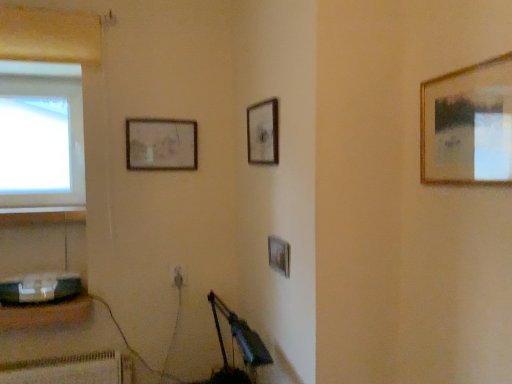
At what (x,y) coordinates should I click in order to perform the action: click on white plastic electric outlet at lower center. Please return your answer as a coordinate pair (x, y). The height and width of the screenshot is (384, 512). Looking at the image, I should click on (178, 277).

Image resolution: width=512 pixels, height=384 pixels. I want to click on transparent glass window at upper left, so click(41, 137).

Describe the element at coordinates (263, 133) in the screenshot. This screenshot has width=512, height=384. I see `wooden picture frame at upper center, the third picture frame viewed from the right` at that location.

This screenshot has width=512, height=384. Identify the location of wooden picture frame at upper center, the third picture frame viewed from the right. (263, 133).

What is the approximate height of metallic gray speaker at lower left?

It is 2.86 inches.

Measure the distance between gold metallic picture frame at upper right, which is the 1th picture frame from right to left, and camera.

The depth of gold metallic picture frame at upper right, which is the 1th picture frame from right to left, is 34.31 inches.

Identify the location of matte black toaster at lower left. This screenshot has width=512, height=384. (40, 288).

In order to click on matte wooden picture frame at upper center, which ranks as the fourth picture frame in right-to-left order in this screenshot , I will do `click(161, 144)`.

What do you see at coordinates (161, 144) in the screenshot?
I see `matte wooden picture frame at upper center, the first picture frame in the back-to-front sequence` at bounding box center [161, 144].

Image resolution: width=512 pixels, height=384 pixels. What do you see at coordinates (279, 255) in the screenshot? I see `wooden picture frame at center, the 2th picture frame viewed from the right` at bounding box center [279, 255].

What are the coordinates of `white plastic electric outlet at lower center` in the screenshot? It's located at (178, 277).

Which of these two, matte wooden picture frame at upper center, the first picture frame in the back-to-front sequence, or wooden picture frame at upper center, the 2th picture frame when ordered from left to right, is smaller?

matte wooden picture frame at upper center, the first picture frame in the back-to-front sequence.

Is matte wooden picture frame at upper center, placed as the fourth picture frame when sorted from front to back, far from wooden picture frame at upper center, the 2th picture frame positioned from the back?

No, matte wooden picture frame at upper center, placed as the fourth picture frame when sorted from front to back, is not far from wooden picture frame at upper center, the 2th picture frame positioned from the back.

Between matte wooden picture frame at upper center, marked as the first picture frame in a left-to-right arrangement, and wooden picture frame at upper center, the 2th picture frame when ordered from left to right, which one appears on the left side from the viewer's perspective?

matte wooden picture frame at upper center, marked as the first picture frame in a left-to-right arrangement, is more to the left.

Measure the distance between matte wooden picture frame at upper center, the first picture frame in the back-to-front sequence, and wooden picture frame at upper center, the 2th picture frame positioned from the back.

matte wooden picture frame at upper center, the first picture frame in the back-to-front sequence, is 46.82 centimeters from wooden picture frame at upper center, the 2th picture frame positioned from the back.

Considering the sizes of matte black toaster at lower left and wooden picture frame at upper center, the 2th picture frame when ordered from left to right, in the image, is matte black toaster at lower left wider or thinner than wooden picture frame at upper center, the 2th picture frame when ordered from left to right,?

Considering their sizes, matte black toaster at lower left looks broader than wooden picture frame at upper center, the 2th picture frame when ordered from left to right.

Is wooden picture frame at upper center, the third picture frame viewed from the right, a part of matte black toaster at lower left?

No, wooden picture frame at upper center, the third picture frame viewed from the right, is located outside of matte black toaster at lower left.

Between matte black toaster at lower left and wooden picture frame at upper center, positioned as the third picture frame in front-to-back order, which one has less height?

With less height is matte black toaster at lower left.

Is point (1, 305) closer to camera compared to point (136, 153)?

Yes, point (1, 305) is in front of point (136, 153).

Looking at this image, from the image's perspective, is metallic gray speaker at lower left positioned above or below matte wooden picture frame at upper center, marked as the first picture frame in a left-to-right arrangement?

Based on their image positions, metallic gray speaker at lower left is located beneath matte wooden picture frame at upper center, marked as the first picture frame in a left-to-right arrangement.

Which of these two, metallic gray speaker at lower left or matte wooden picture frame at upper center, the first picture frame in the back-to-front sequence, is bigger?

With larger size is metallic gray speaker at lower left.

Which of these two, metallic gray speaker at lower left or matte wooden picture frame at upper center, the first picture frame in the back-to-front sequence, is wider?

metallic gray speaker at lower left.

Between transparent glass window at upper left and wooden picture frame at center, which is the third picture frame in left-to-right order, which one has less height?

wooden picture frame at center, which is the third picture frame in left-to-right order, is shorter.

From the image's perspective, is transparent glass window at upper left on wooden picture frame at center, the 2th picture frame viewed from the right?

Yes, from the image's perspective, transparent glass window at upper left is above wooden picture frame at center, the 2th picture frame viewed from the right.

Consider the image. From the image's perspective, which is above, matte black toaster at lower left or metallic gray speaker at lower left?

matte black toaster at lower left.

Are matte black toaster at lower left and metallic gray speaker at lower left beside each other?

Indeed, matte black toaster at lower left and metallic gray speaker at lower left are beside each other and touching.

From a real-world perspective, who is located higher, matte black toaster at lower left or metallic gray speaker at lower left?

matte black toaster at lower left.

Image resolution: width=512 pixels, height=384 pixels. In the image, there is a matte wooden picture frame at upper center, marked as the first picture frame in a left-to-right arrangement. Identify the location of window above it (from the image's perspective). point(41,137).

Is matte wooden picture frame at upper center, marked as the first picture frame in a left-to-right arrangement, oriented towards transparent glass window at upper left?

No, matte wooden picture frame at upper center, marked as the first picture frame in a left-to-right arrangement, is not aimed at transparent glass window at upper left.

From the image's perspective, is gold metallic picture frame at upper right, the 4th picture frame in the back-to-front sequence, on top of matte black toaster at lower left?

Indeed, from the image's perspective, gold metallic picture frame at upper right, the 4th picture frame in the back-to-front sequence, is shown above matte black toaster at lower left.

Is point (471, 118) in front of point (69, 275)?

Yes.

In terms of width, does gold metallic picture frame at upper right, which appears as the 4th picture frame when viewed from the left, look wider or thinner when compared to matte black toaster at lower left?

Considering their sizes, gold metallic picture frame at upper right, which appears as the 4th picture frame when viewed from the left, looks slimmer than matte black toaster at lower left.

Is gold metallic picture frame at upper right, which is the 1th picture frame from right to left, in front of or behind matte black toaster at lower left in the image?

Clearly, gold metallic picture frame at upper right, which is the 1th picture frame from right to left, is in front of matte black toaster at lower left.

You are a GUI agent. You are given a task and a screenshot of the screen. Output one action in this format:
    pyautogui.click(x=<x>, y=<y>)
    Task: Click on the picture frame positioned vertically above the matte wooden picture frame at upper center, which ranks as the fourth picture frame in right-to-left order (from a real-world perspective)
    
    Given the screenshot: What is the action you would take?
    pyautogui.click(x=263, y=133)

This screenshot has width=512, height=384. I want to click on the 4th picture frame above the matte black toaster at lower left (from the image's perspective), so click(x=263, y=133).

Considering their positions, is wooden picture frame at center, which is counted as the 2th picture frame, starting from the front, positioned further to transparent glass window at upper left than white plastic electric outlet at lower center?

wooden picture frame at center, which is counted as the 2th picture frame, starting from the front.

Estimate the real-world distances between objects in this image. Which object is closer to white plastic electric outlet at lower center, transparent glass window at upper left or wooden picture frame at center, which is counted as the 2th picture frame, starting from the front?

wooden picture frame at center, which is counted as the 2th picture frame, starting from the front.

Which object lies further to the anchor point white plastic electric outlet at lower center, transparent glass window at upper left or gold metallic picture frame at upper right, the first picture frame in the front-to-back sequence?

Among the two, gold metallic picture frame at upper right, the first picture frame in the front-to-back sequence, is located further to white plastic electric outlet at lower center.

From the picture: Which object lies further to the anchor point gold metallic picture frame at upper right, the first picture frame in the front-to-back sequence, white plastic electric outlet at lower center or matte black toaster at lower left?

Based on the image, matte black toaster at lower left appears to be further to gold metallic picture frame at upper right, the first picture frame in the front-to-back sequence.

Estimate the real-world distances between objects in this image. Which object is further from gold metallic picture frame at upper right, which appears as the 4th picture frame when viewed from the left, wooden picture frame at upper center, the 2th picture frame positioned from the back, or matte wooden picture frame at upper center, which ranks as the fourth picture frame in right-to-left order?

The object further to gold metallic picture frame at upper right, which appears as the 4th picture frame when viewed from the left, is matte wooden picture frame at upper center, which ranks as the fourth picture frame in right-to-left order.

Based on their spatial positions, is matte black toaster at lower left or wooden picture frame at center, the 2th picture frame viewed from the right, closer to gold metallic picture frame at upper right, the first picture frame in the front-to-back sequence?

wooden picture frame at center, the 2th picture frame viewed from the right.

Considering their positions, is transparent glass window at upper left positioned further to white plastic electric outlet at lower center than matte black toaster at lower left?

transparent glass window at upper left is positioned further to the anchor white plastic electric outlet at lower center.

Based on their spatial positions, is wooden picture frame at upper center, positioned as the third picture frame in front-to-back order, or transparent glass window at upper left closer to gold metallic picture frame at upper right, the 4th picture frame in the back-to-front sequence?

wooden picture frame at upper center, positioned as the third picture frame in front-to-back order, is positioned closer to the anchor gold metallic picture frame at upper right, the 4th picture frame in the back-to-front sequence.

Find the location of a particular element. This screenshot has height=384, width=512. appliance situated between metallic gray speaker at lower left and wooden picture frame at center, which is counted as the 2th picture frame, starting from the front, from left to right is located at coordinates (40, 288).

I want to click on appliance between matte wooden picture frame at upper center, placed as the fourth picture frame when sorted from front to back, and metallic gray speaker at lower left in the up-down direction, so click(x=40, y=288).

Where is `electric outlet between transparent glass window at upper left and wooden picture frame at center, which is the third picture frame in left-to-right order`? Image resolution: width=512 pixels, height=384 pixels. electric outlet between transparent glass window at upper left and wooden picture frame at center, which is the third picture frame in left-to-right order is located at coordinates (178, 277).

At what (x,y) coordinates should I click in order to perform the action: click on electric outlet located between matte black toaster at lower left and gold metallic picture frame at upper right, the 4th picture frame in the back-to-front sequence, in the left-right direction. Please return your answer as a coordinate pair (x, y). The image size is (512, 384). Looking at the image, I should click on (178, 277).